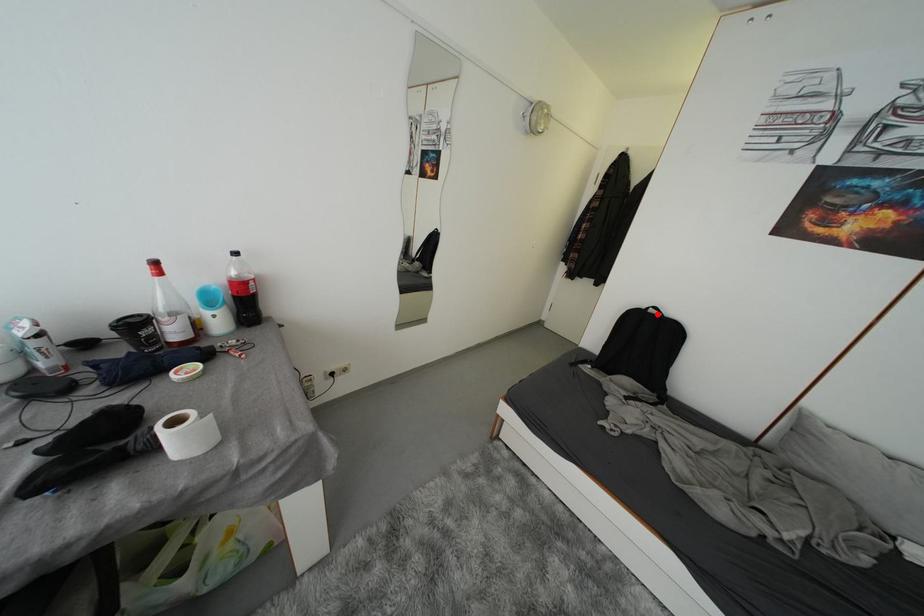
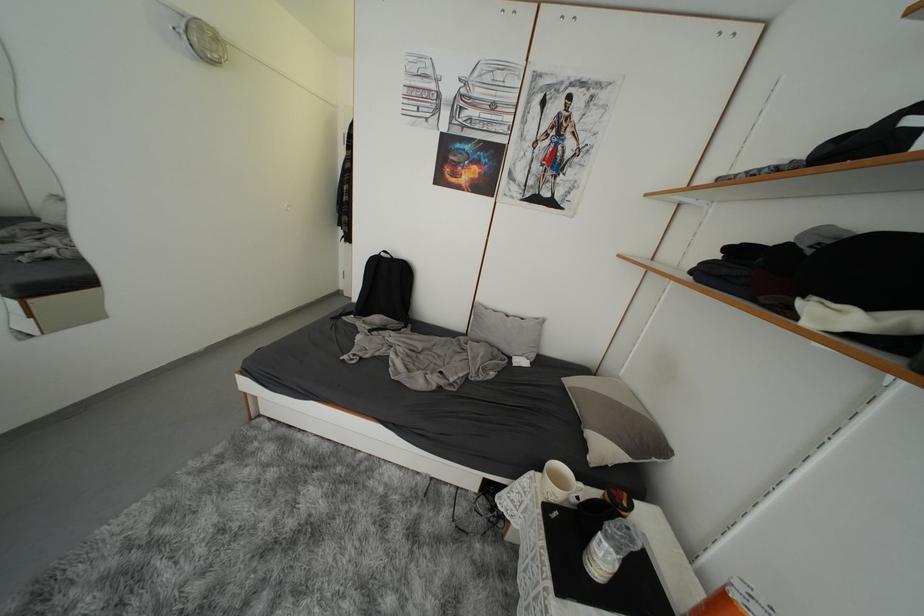
Find the pixel in the second image that matches the highlighted location in the first image.

(390, 257)